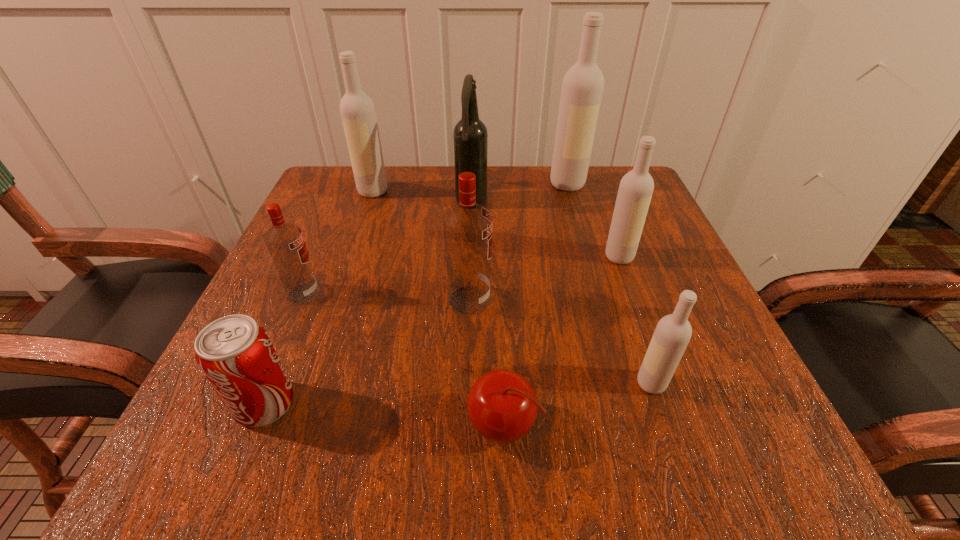
Where is `the biggest white vodka`? This screenshot has width=960, height=540. the biggest white vodka is located at coordinates (582, 88).

Where is `the tallest object`? This screenshot has width=960, height=540. the tallest object is located at coordinates (582, 88).

Locate an element on the screen. Image resolution: width=960 pixels, height=540 pixels. the second tallest vodka is located at coordinates (357, 110).

Identify the location of the third smallest white vodka. The width and height of the screenshot is (960, 540). (357, 110).

Locate an element on the screen. beer bottle is located at coordinates (470, 137).

Where is `the third farthest vodka`? The image size is (960, 540). the third farthest vodka is located at coordinates (635, 191).

Image resolution: width=960 pixels, height=540 pixels. I want to click on the third biggest white vodka, so click(x=635, y=191).

The height and width of the screenshot is (540, 960). What are the coordinates of `the third vodka from left to right` in the screenshot? It's located at (468, 226).

Locate an element on the screen. The height and width of the screenshot is (540, 960). the right red vodka is located at coordinates (468, 226).

At what (x,y) coordinates should I click in order to perform the action: click on the smaller red vodka. Please return your answer as a coordinate pair (x, y). The height and width of the screenshot is (540, 960). Looking at the image, I should click on (285, 242).